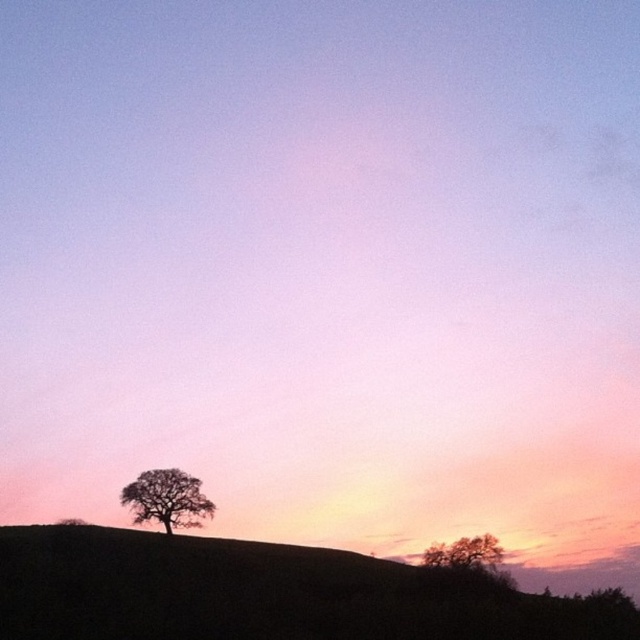
You are an artist trying to sketch the scene. You want to place the silhouette grass at lower left in your drawing. According to the coordinates provided, where should you position it on a 1x1 grid? Please specify the coordinates as a point with two decimal places.

The silhouette grass at lower left should be positioned at coordinates approximately (268, 595) on the 1x1 grid.

You are a photographer trying to capture the two points in the image. Which point, point (464, 609) or point (490, 560), is closer to your camera lens?

Point (464, 609) is closer to the camera lens than point (490, 560).

You are an observer looking at the landscape scene. You notice the silhouette grass at lower left and the silhouette leafy tree at lower left. Which of these two objects appears taller in the image?

The silhouette grass at lower left appears taller than the silhouette leafy tree at lower left according to the description.